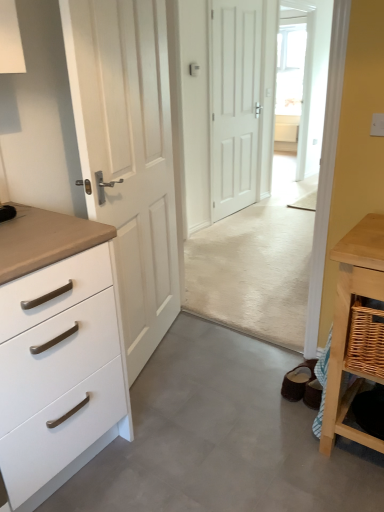
Image resolution: width=384 pixels, height=512 pixels. Find the location of `free space in front of woven wood table at right`. free space in front of woven wood table at right is located at coordinates coord(327,461).